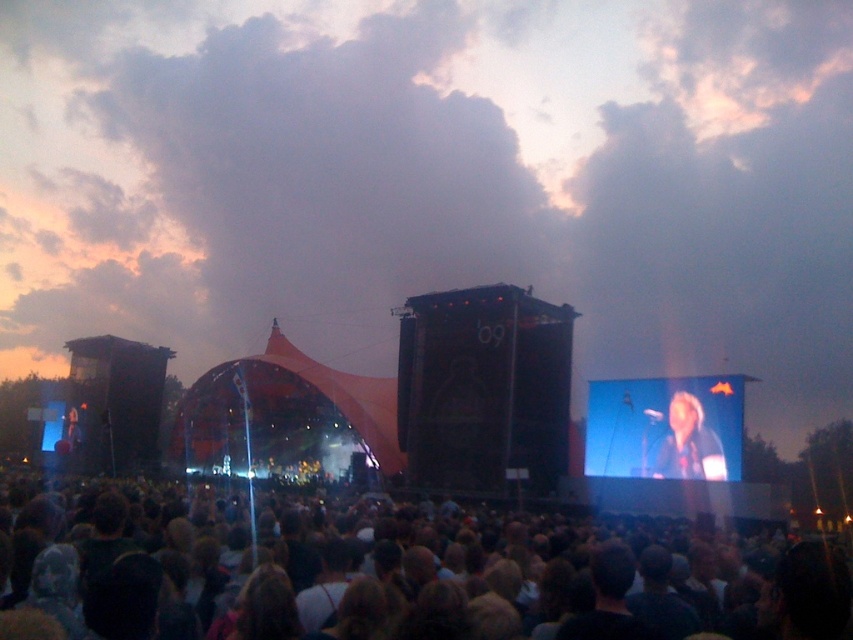
You are a stagehand at the concert and need to locate the matte black microphone at center. According to the coordinates provided, where should you look on the stage?

The matte black microphone at center is located at point coordinates 0.669 on the x axis and 0.781 on the y axis.

You are a photographer at the concert and want to capture both the brown hair at center and the shiny black hair at center in a single shot. Which hairstyle should you focus on first to ensure both are in frame?

The brown hair at center has a lesser height compared to shiny black hair at center, so you should focus on the shiny black hair at center first to ensure both are in frame.